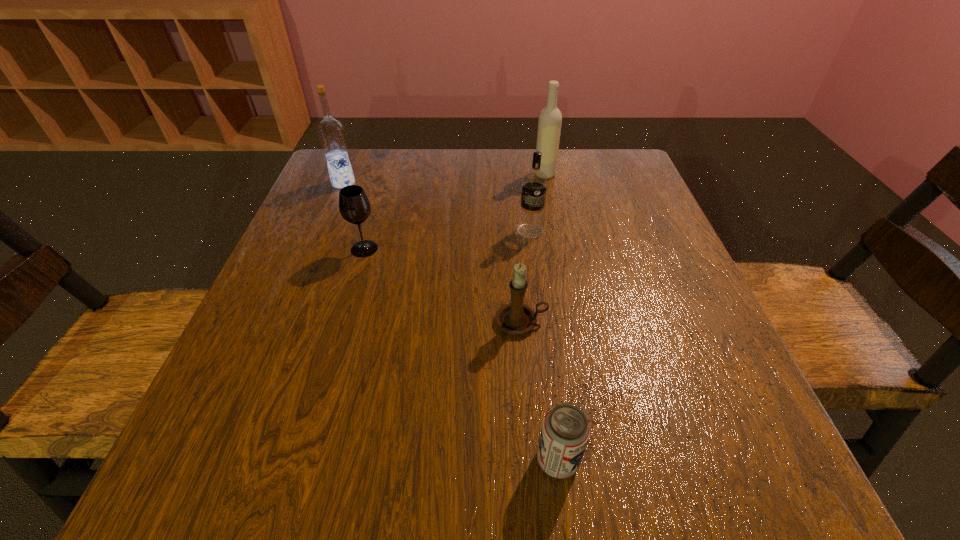
Find the location of a particular element. free spot located 0.350m on the back of the third nearest object is located at coordinates (392, 156).

Locate an element on the screen. The image size is (960, 540). free space located 0.140m on the side of the second nearest object with the handle is located at coordinates (629, 321).

The height and width of the screenshot is (540, 960). Identify the location of vacant region located 0.100m on the left of the shortest object. (461, 460).

At what (x,y) coordinates should I click in order to perform the action: click on object present at the near edge. Please return your answer as a coordinate pair (x, y). Looking at the image, I should click on (565, 431).

You are a GUI agent. You are given a task and a screenshot of the screen. Output one action in this format:
    pyautogui.click(x=<x>, y=<y>)
    Task: Click on the vodka that is at the left edge
    
    Given the screenshot: What is the action you would take?
    pyautogui.click(x=331, y=133)

The image size is (960, 540). In order to click on wineglass that is at the left edge in this screenshot , I will do 354,206.

You are a GUI agent. You are given a task and a screenshot of the screen. Output one action in this format:
    pyautogui.click(x=<x>, y=<y>)
    Task: Click on the object that is at the far left corner
    This screenshot has width=960, height=540.
    Given the screenshot: What is the action you would take?
    pyautogui.click(x=331, y=133)

Image resolution: width=960 pixels, height=540 pixels. In the image, there is a desktop. What are the coordinates of `vacant space at the far edge` in the screenshot? It's located at (505, 158).

Identify the location of vacant space at the near edge of the desktop. The image size is (960, 540). (453, 485).

Find the location of a particular element. The height and width of the screenshot is (540, 960). blank space at the left edge of the desktop is located at coordinates (333, 239).